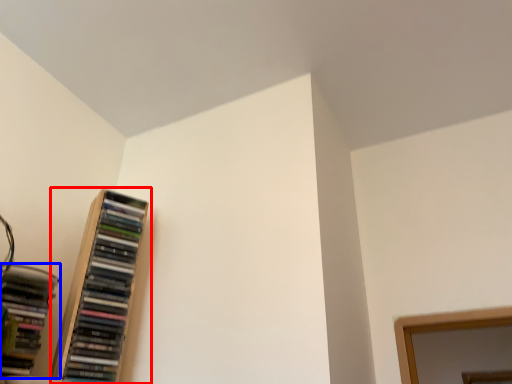
Question: Which point is closer to the camera, bookcase (highlighted by a red box) or book (highlighted by a blue box)?

Choices:
 (A) bookcase
 (B) book

Answer: (B)